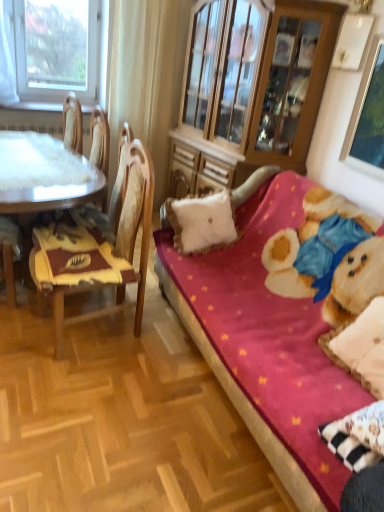
Question: From a real-world perspective, is white fabric curtain at upper left above or below white soft cushion at center?

Choices:
 (A) below
 (B) above

Answer: (B)

Question: Is white fabric curtain at upper left situated inside white soft cushion at center or outside?

Choices:
 (A) inside
 (B) outside

Answer: (B)

Question: Considering the real-world distances, which object is farthest from the white soft cushion at center?

Choices:
 (A) velvet pink couch at right
 (B) wooden chair at left
 (C) white glossy table at left
 (D) metallic silver picture frame at upper right
 (E) transparent glass window at upper left

Answer: (E)

Question: Which object is the farthest from the transparent glass window at upper left?

Choices:
 (A) wooden cabinet at center
 (B) metallic silver picture frame at upper right
 (C) white soft cushion at center
 (D) velvet pink couch at right
 (E) wooden chair at left

Answer: (B)